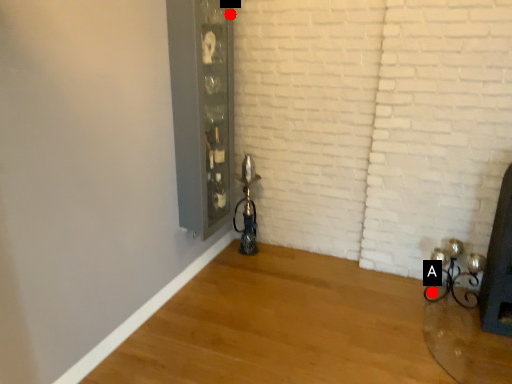
Question: Two points are circled on the image, labeled by A and B beside each circle. Among these points, which one is nearest to the camera?

Choices:
 (A) A is closer
 (B) B is closer

Answer: (B)